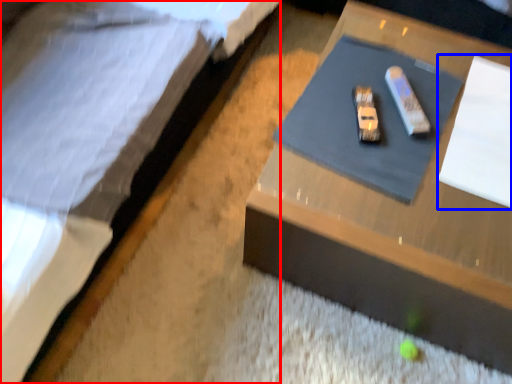
Question: Which object appears closest to the camera in this image, bed (highlighted by a red box) or notepad (highlighted by a blue box)?

Choices:
 (A) bed
 (B) notepad

Answer: (A)